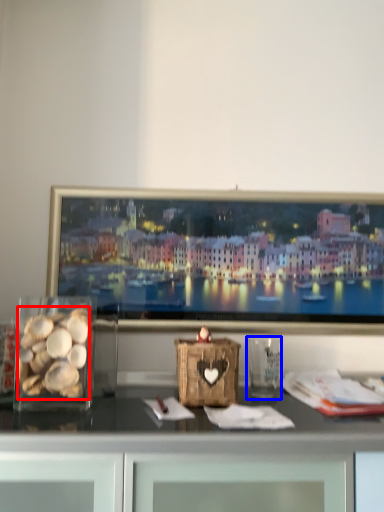
Question: Which point is further to the camera, food (highlighted by a red box) or glass vase (highlighted by a blue box)?

Choices:
 (A) food
 (B) glass vase

Answer: (B)